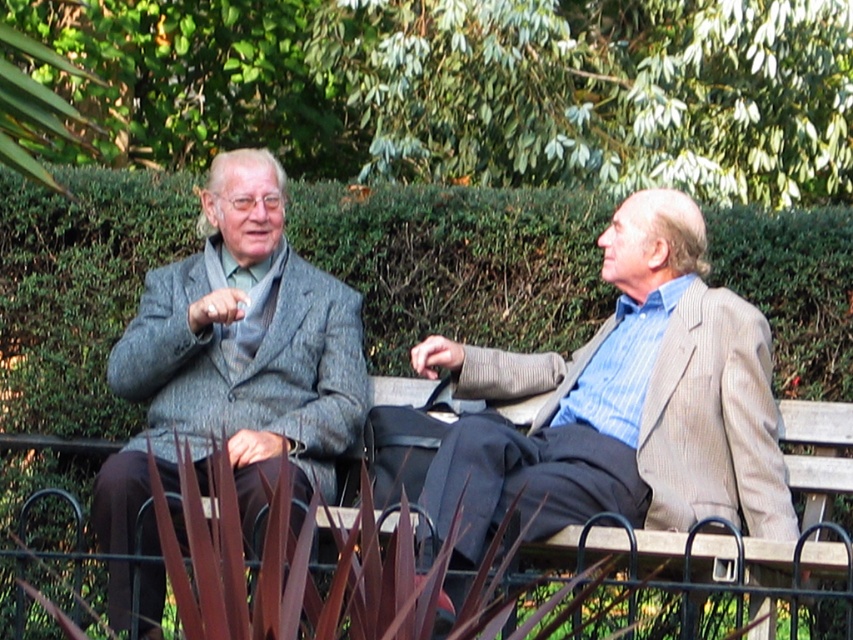
You are a photographer standing at the center of the park. You want to take a photo of the light brown textured suit at right and the gray tweed jacket at left. Can you fit both of them in the frame of your camera which has a 5 meter width?

The distance between the light brown textured suit at right and the gray tweed jacket at left is 5.50 meters. Since the camera frame can only capture 5 meters width, they are too far apart to fit within the frame.

You are a photographer trying to capture a portrait of the gray woolen suit at left and the wooden bench at center. Which object should you focus on first if you want to ensure both are in sharp focus?

The gray woolen suit at left is much taller than the wooden bench at center, so focusing on the gray woolen suit at left first will help ensure both are in sharp focus.